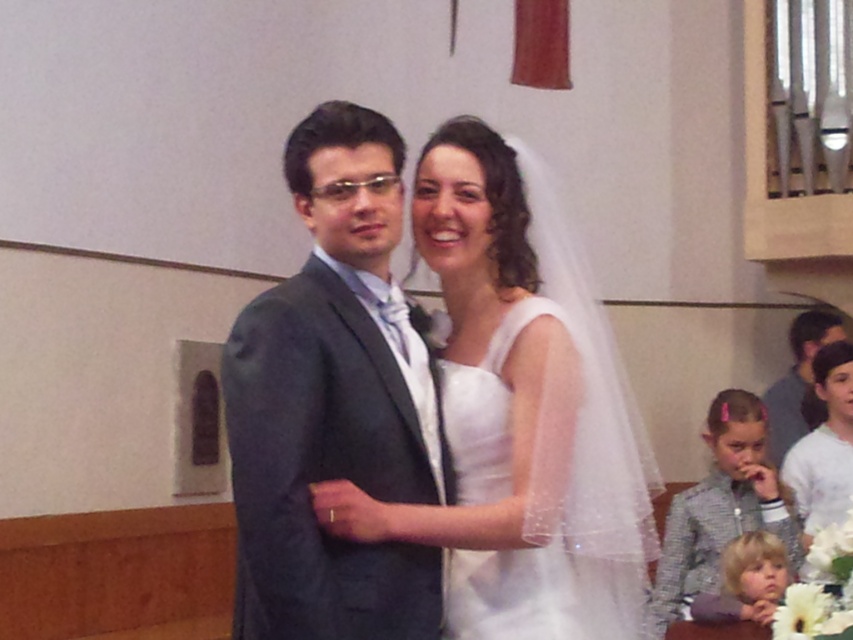
Who is positioned more to the left, matte gray suit at center or white sheer fabric dress at center?

matte gray suit at center

Who is taller, matte gray suit at center or white sheer fabric dress at center?

Standing taller between the two is matte gray suit at center.

I want to click on matte gray suit at center, so click(x=334, y=403).

Find the location of a particular element. This screenshot has height=640, width=853. matte gray suit at center is located at coordinates (334, 403).

Which is behind, point (421, 342) or point (828, 449)?

Positioned behind is point (828, 449).

The height and width of the screenshot is (640, 853). Describe the element at coordinates (334, 403) in the screenshot. I see `matte gray suit at center` at that location.

Locate an element on the screen. matte gray suit at center is located at coordinates (334, 403).

At what (x,y) coordinates should I click in order to perform the action: click on white satin dress at center. Please return your answer as a coordinate pair (x, y). Looking at the image, I should click on (519, 417).

Is white satin dress at center closer to camera compared to matte gray suit at center?

No, white satin dress at center is behind matte gray suit at center.

Where is `white satin dress at center`? white satin dress at center is located at coordinates (519, 417).